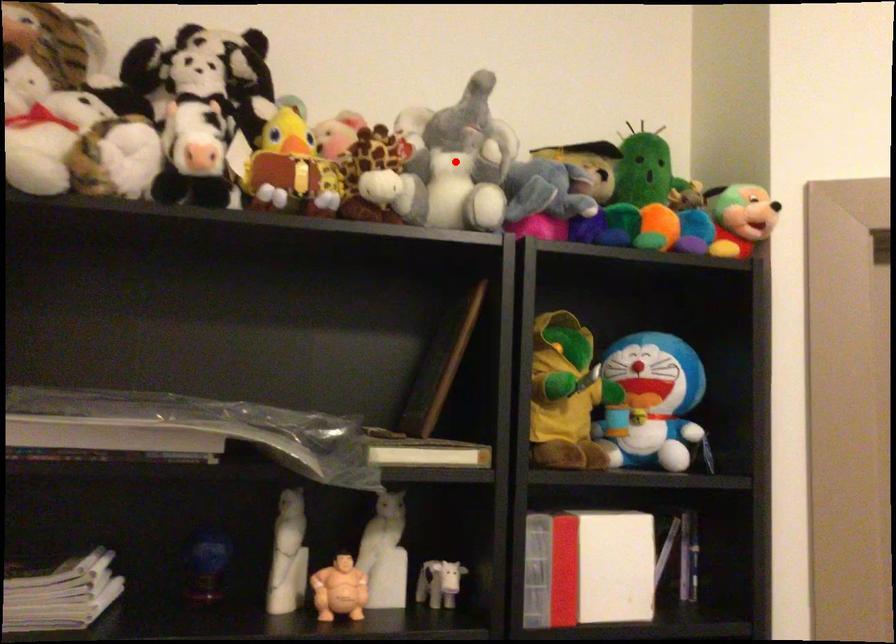
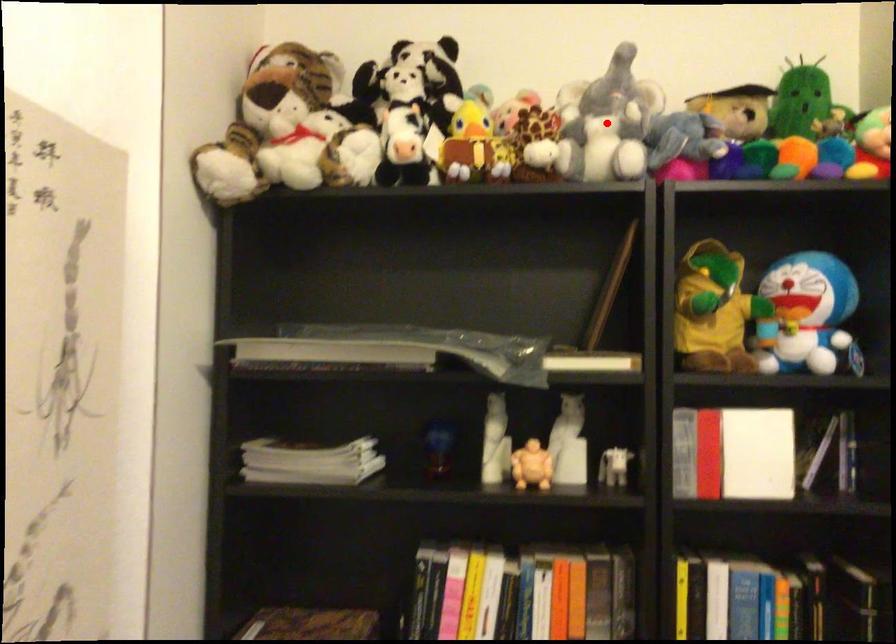
I am providing you with two images of the same scene from different viewpoints. A red point is marked on the first image and another point is marked on the second image. Are the points marked in image1 and image2 representing the same 3D position?

Yes